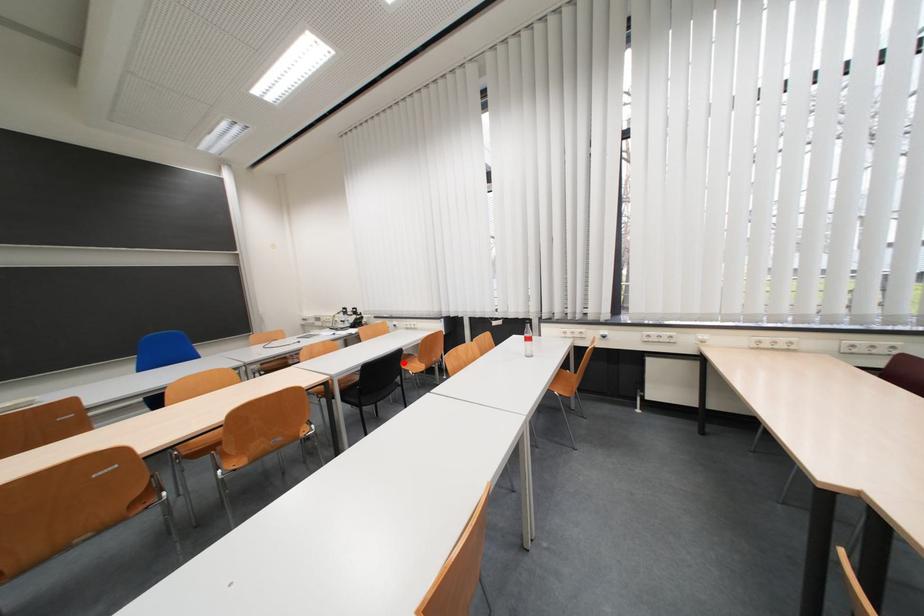
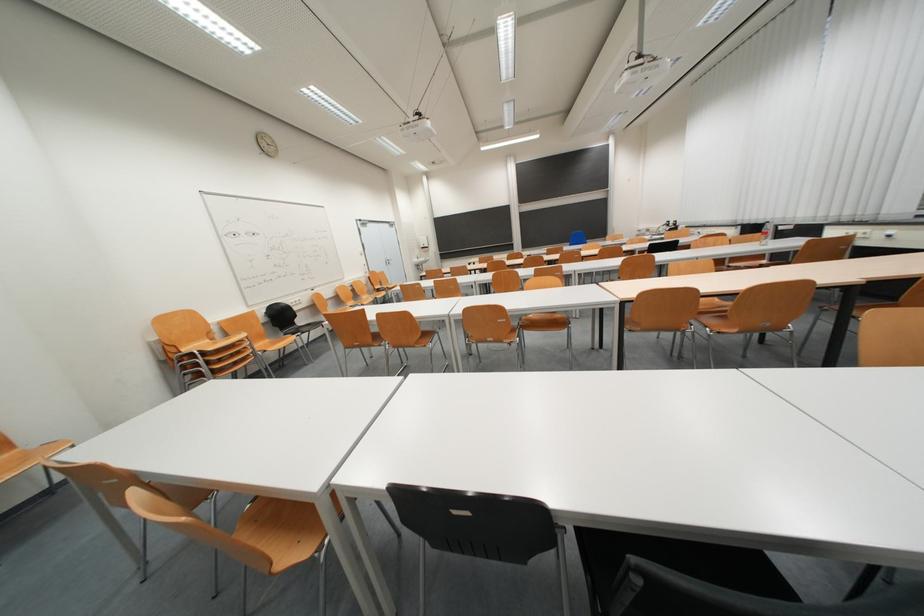
Question: I am providing you with two images of the same scene from different viewpoints. A red point is marked on the first image. Can you still see the location of the red point in image 2?

Choices:
 (A) Yes
 (B) No

Answer: (B)